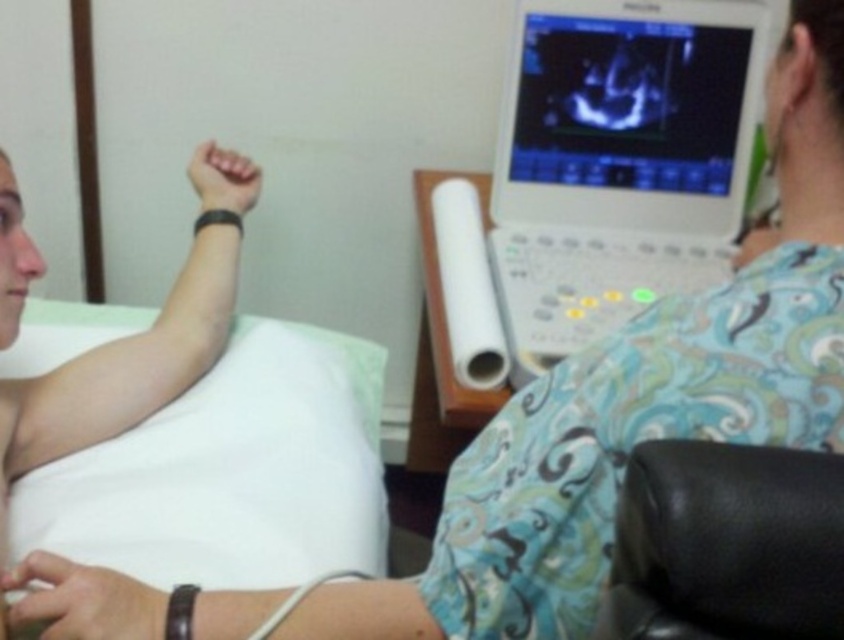
Describe the element at coordinates (230, 472) in the screenshot. The image size is (844, 640). I see `white fabric bed at upper left` at that location.

Can you confirm if white fabric bed at upper left is positioned above black leather armchair at lower right?

Correct, white fabric bed at upper left is located above black leather armchair at lower right.

What do you see at coordinates (230, 472) in the screenshot?
I see `white fabric bed at upper left` at bounding box center [230, 472].

Find the location of a particular element. The height and width of the screenshot is (640, 844). white fabric bed at upper left is located at coordinates (230, 472).

Does matte plastic monitor at upper right have a lesser height compared to black leather armchair at lower right?

Incorrect, matte plastic monitor at upper right's height does not fall short of black leather armchair at lower right's.

Is matte plastic monitor at upper right bigger than black leather armchair at lower right?

Yes, matte plastic monitor at upper right is bigger than black leather armchair at lower right.

From the picture: Who is more distant from viewer, (659, 72) or (641, 589)?

The point (659, 72) is behind.

Where is `matte plastic monitor at upper right`? matte plastic monitor at upper right is located at coordinates (630, 115).

Does white fabric bed at upper left have a larger size compared to matte plastic monitor at upper right?

Yes.

Is point (315, 433) positioned after point (539, 140)?

No, (315, 433) is in front of (539, 140).

Identify the location of white fabric bed at upper left. (230, 472).